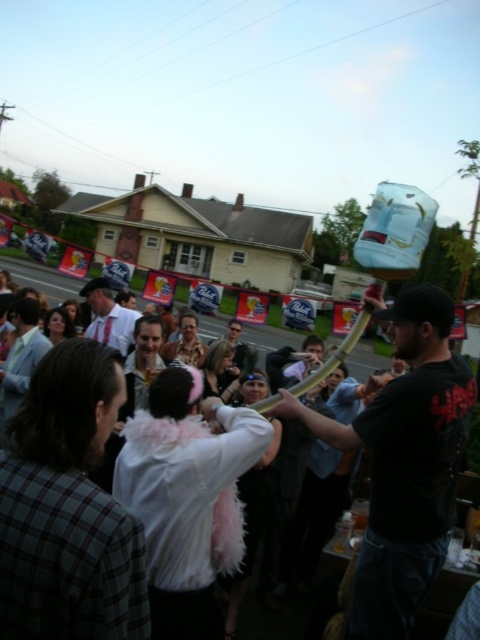
Can you confirm if white shirt at center is positioned to the left of matte white shirt at center?

Correct, you'll find white shirt at center to the left of matte white shirt at center.

Is white shirt at center positioned before matte white shirt at center?

That is False.

Identify the location of white shirt at center. (108, 316).

Where is `white shirt at center`? This screenshot has width=480, height=640. white shirt at center is located at coordinates click(x=108, y=316).

Between black matte pipe at center and white shirt at center, which one appears on the right side from the viewer's perspective?

From the viewer's perspective, black matte pipe at center appears more on the right side.

Who is shorter, black matte pipe at center or white shirt at center?

white shirt at center is shorter.

This screenshot has width=480, height=640. What are the coordinates of `black matte pipe at center` in the screenshot? It's located at (405, 461).

What do you see at coordinates (405, 461) in the screenshot?
I see `black matte pipe at center` at bounding box center [405, 461].

Does black matte pipe at center lie behind matte white shirt at center?

No, black matte pipe at center is closer to the viewer.

Between point (371, 513) and point (216, 339), which one is positioned behind?

Positioned behind is point (216, 339).

Image resolution: width=480 pixels, height=640 pixels. Identify the location of black matte pipe at center. click(405, 461).